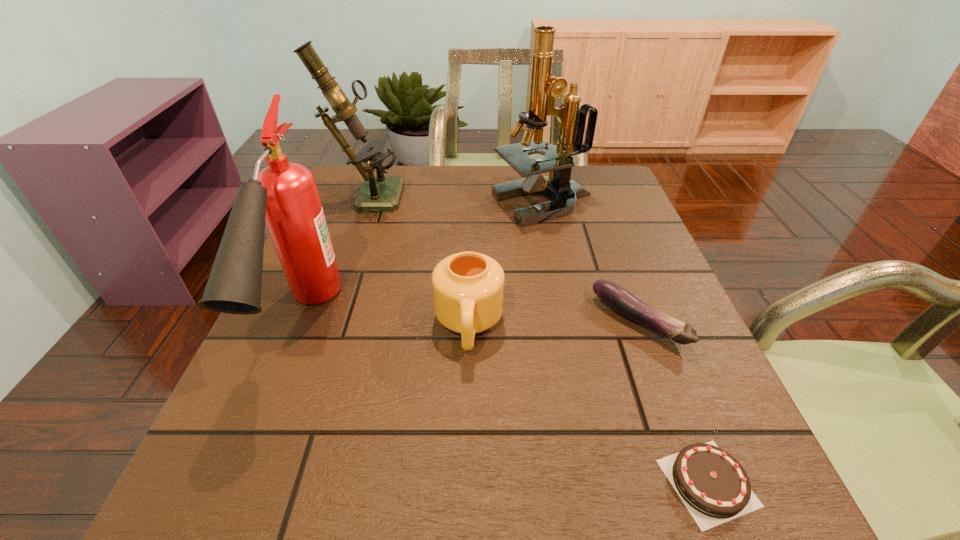
Image resolution: width=960 pixels, height=540 pixels. In order to click on vacant space that satisfies the following two spatial constraints: 1. at the eyepiece of the left microscope; 2. on the back side of the shortest object in this screenshot , I will do `click(258, 483)`.

Find the location of `free space that satisfies the following two spatial constraints: 1. on the back side of the nearest object; 2. at the eyepiece of the right microscope`. free space that satisfies the following two spatial constraints: 1. on the back side of the nearest object; 2. at the eyepiece of the right microscope is located at coordinates (601, 204).

At what (x,y) coordinates should I click in order to perform the action: click on free location that satisfies the following two spatial constraints: 1. at the eyepiece of the left microscope; 2. on the back side of the nearest object. Please return your answer as a coordinate pair (x, y). This screenshot has width=960, height=540. Looking at the image, I should click on (258, 483).

Find the location of a particular element. This screenshot has width=960, height=540. free location that satisfies the following two spatial constraints: 1. at the eyepiece of the right microscope; 2. on the right side of the fifth tallest object is located at coordinates click(566, 322).

Where is `free spot that satisfies the following two spatial constraints: 1. at the eyepiece of the shortest object; 2. on the right side of the right microscope`? The width and height of the screenshot is (960, 540). free spot that satisfies the following two spatial constraints: 1. at the eyepiece of the shortest object; 2. on the right side of the right microscope is located at coordinates (599, 483).

You are a GUI agent. You are given a task and a screenshot of the screen. Output one action in this format:
    pyautogui.click(x=<x>, y=<y>)
    Task: Click on the vacant space that satisfies the following two spatial constraints: 1. at the eyepiece of the left microscope; 2. on the left side of the nearest object
    The image size is (960, 540).
    Given the screenshot: What is the action you would take?
    pyautogui.click(x=258, y=483)